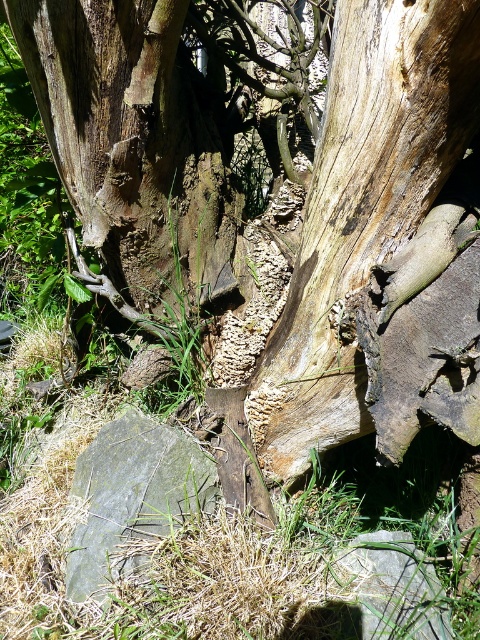
Question: Which object is farther from the camera taking this photo?

Choices:
 (A) gray slate rock at lower left
 (B) light brown rough bark at center

Answer: (A)

Question: Can you confirm if light brown rough bark at center is wider than gray slate rock at lower left?

Choices:
 (A) no
 (B) yes

Answer: (B)

Question: Which of the following is the farthest from the observer?

Choices:
 (A) gray slate rock at lower left
 (B) light brown rough bark at center

Answer: (A)

Question: Can you confirm if light brown rough bark at center is wider than gray slate rock at lower left?

Choices:
 (A) yes
 (B) no

Answer: (A)

Question: Observing the image, what is the correct spatial positioning of light brown rough bark at center in reference to gray slate rock at lower left?

Choices:
 (A) left
 (B) right

Answer: (B)